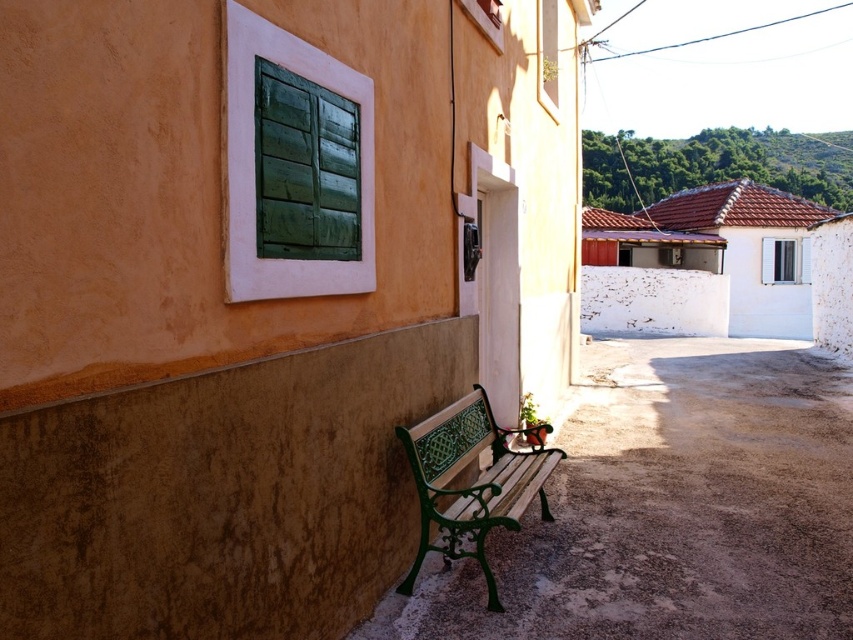
You are standing on the street and see two points marked in the image. The first point is at position point (x=717, y=573) and the second is at point (x=467, y=461). Which point is closer to you?

Point (x=717, y=573) is in front of point (x=467, y=461), so the first point is closer to you.

You are standing at the point marked by coordinates point (672, 508). Based on the scene description, what object are you most likely standing on?

The point (672, 508) marks the green painted wood bench at lower center, so you are most likely standing on the green painted wood bench at lower center.

You are a painter who needs to place a 5 feet long ladder between the green painted wood bench at lower center and the green wrought iron bench at lower center. Can the ladder fit between them without overlapping either bench?

The distance between the green painted wood bench at lower center and the green wrought iron bench at lower center is 4.06 feet. Since the ladder is 5 feet long, it cannot fit between them without overlapping either bench.